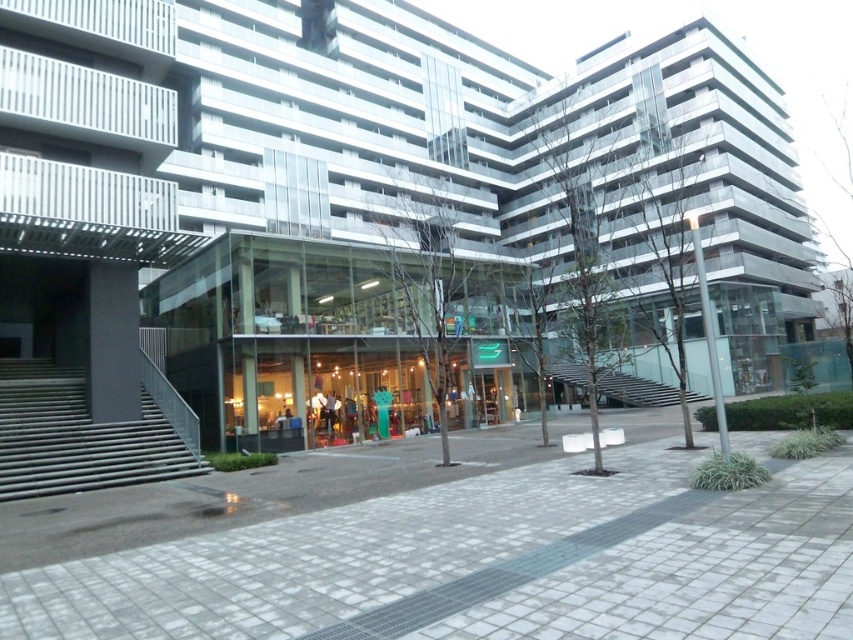
Who is positioned more to the left, gray cobblestone pavement at center or metallic gray stairs at left?

From the viewer's perspective, metallic gray stairs at left appears more on the left side.

From the picture: Which of these two, gray cobblestone pavement at center or metallic gray stairs at left, stands taller?

metallic gray stairs at left is taller.

The image size is (853, 640). What do you see at coordinates (486, 564) in the screenshot?
I see `gray cobblestone pavement at center` at bounding box center [486, 564].

The width and height of the screenshot is (853, 640). I want to click on gray cobblestone pavement at center, so click(486, 564).

Does metallic gray stairs at left have a greater width compared to glass transparent stairs at center?

No, metallic gray stairs at left is not wider than glass transparent stairs at center.

Does metallic gray stairs at left have a lesser height compared to glass transparent stairs at center?

Yes, metallic gray stairs at left is shorter than glass transparent stairs at center.

Find the location of a particular element. The width and height of the screenshot is (853, 640). metallic gray stairs at left is located at coordinates (77, 436).

Does gray cobblestone pavement at center have a greater width compared to glass transparent stairs at center?

In fact, gray cobblestone pavement at center might be narrower than glass transparent stairs at center.

Which is in front, point (796, 470) or point (671, 388)?

Positioned in front is point (796, 470).

The width and height of the screenshot is (853, 640). In order to click on gray cobblestone pavement at center in this screenshot , I will do `click(486, 564)`.